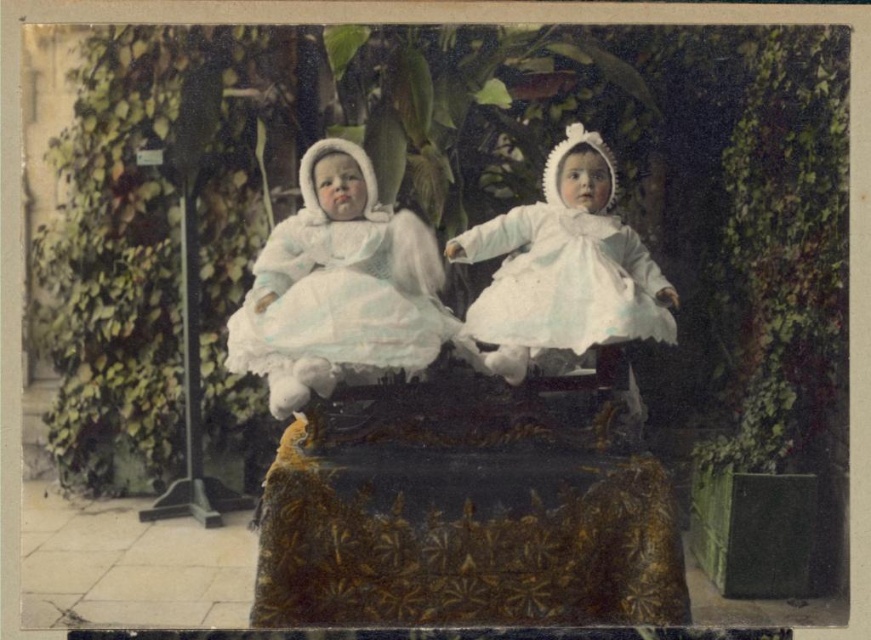
Does white satin dress at center have a greater width compared to white lace dress at center?

In fact, white satin dress at center might be narrower than white lace dress at center.

This screenshot has height=640, width=871. What do you see at coordinates (339, 288) in the screenshot?
I see `white satin dress at center` at bounding box center [339, 288].

The width and height of the screenshot is (871, 640). What do you see at coordinates (339, 288) in the screenshot?
I see `white satin dress at center` at bounding box center [339, 288].

This screenshot has width=871, height=640. I want to click on white satin dress at center, so click(x=339, y=288).